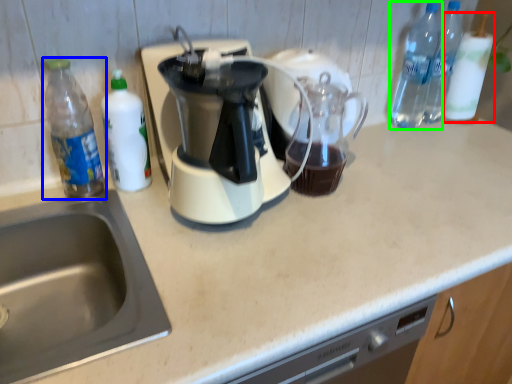
Question: Which is nearer to the bottle (highlighted by a red box)? bottle (highlighted by a blue box) or bottle (highlighted by a green box).

Choices:
 (A) bottle
 (B) bottle

Answer: (B)